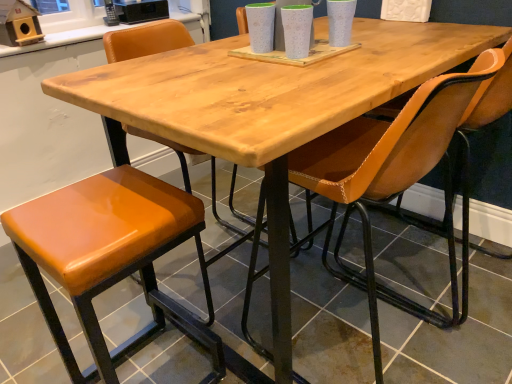
Identify the location of empty space that is ontop of orange leather stool at lower left (from a real-world perspective). (96, 201).